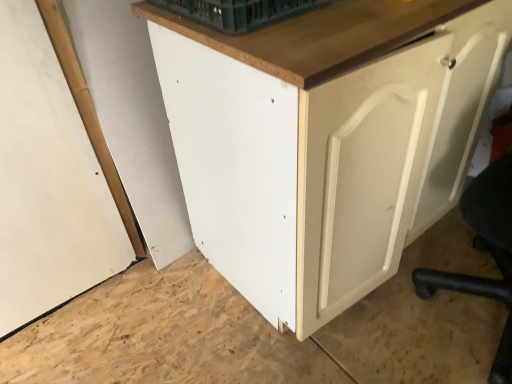
Question: Is white matte door at right at the left side of matte white cabinet at center?

Choices:
 (A) yes
 (B) no

Answer: (B)

Question: Does white matte door at right have a smaller size compared to matte white cabinet at center?

Choices:
 (A) no
 (B) yes

Answer: (B)

Question: From the image's perspective, would you say white matte door at right is positioned over matte white cabinet at center?

Choices:
 (A) yes
 (B) no

Answer: (A)

Question: Is white matte door at right next to matte white cabinet at center?

Choices:
 (A) yes
 (B) no

Answer: (B)

Question: Is white matte door at right taller than matte white cabinet at center?

Choices:
 (A) no
 (B) yes

Answer: (A)

Question: From a real-world perspective, is white matte door at right physically below matte white cabinet at center?

Choices:
 (A) no
 (B) yes

Answer: (A)

Question: Is matte white cabinet at center positioned with its back to green plastic basket at upper center?

Choices:
 (A) no
 (B) yes

Answer: (A)

Question: Would you say matte white cabinet at center is outside green plastic basket at upper center?

Choices:
 (A) yes
 (B) no

Answer: (A)

Question: From the image's perspective, is matte white cabinet at center over green plastic basket at upper center?

Choices:
 (A) no
 (B) yes

Answer: (A)

Question: Is matte white cabinet at center further to the viewer compared to green plastic basket at upper center?

Choices:
 (A) no
 (B) yes

Answer: (A)

Question: Can you confirm if matte white cabinet at center is bigger than green plastic basket at upper center?

Choices:
 (A) no
 (B) yes

Answer: (B)

Question: Could you tell me if matte white cabinet at center is turned towards green plastic basket at upper center?

Choices:
 (A) no
 (B) yes

Answer: (A)

Question: Is green plastic basket at upper center positioned beyond the bounds of matte white cabinet at center?

Choices:
 (A) yes
 (B) no

Answer: (A)